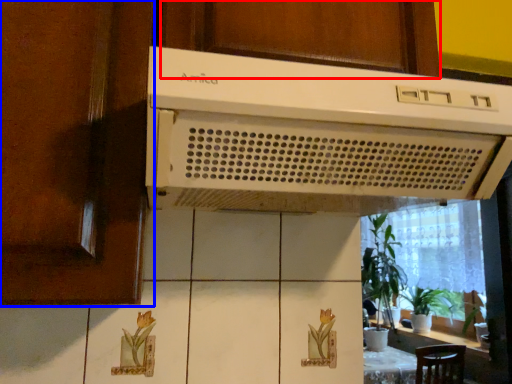
Question: Among these objects, which one is nearest to the camera, cabinetry (highlighted by a red box) or screen door (highlighted by a blue box)?

Choices:
 (A) cabinetry
 (B) screen door

Answer: (B)